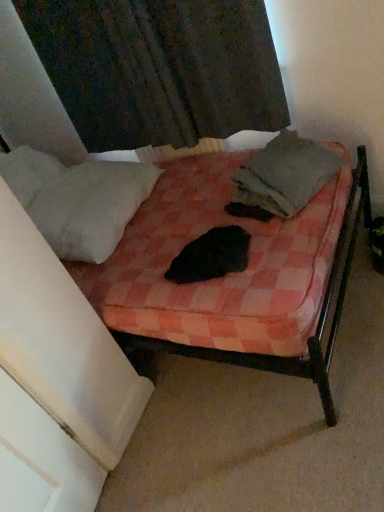
Question: Would you say pink checkered fabric bed at center is outside gray cotton blanket at center?

Choices:
 (A) yes
 (B) no

Answer: (A)

Question: Does pink checkered fabric bed at center appear on the right side of gray cotton blanket at center?

Choices:
 (A) no
 (B) yes

Answer: (A)

Question: Considering the relative sizes of pink checkered fabric bed at center and gray cotton blanket at center in the image provided, is pink checkered fabric bed at center bigger than gray cotton blanket at center?

Choices:
 (A) no
 (B) yes

Answer: (B)

Question: From a real-world perspective, is pink checkered fabric bed at center below gray cotton blanket at center?

Choices:
 (A) yes
 (B) no

Answer: (B)

Question: Does pink checkered fabric bed at center have a lesser width compared to gray cotton blanket at center?

Choices:
 (A) no
 (B) yes

Answer: (A)

Question: Is pink checkered fabric bed at center in contact with gray cotton blanket at center?

Choices:
 (A) no
 (B) yes

Answer: (A)

Question: Is white fluffy pillow at left bigger than gray cotton blanket at center?

Choices:
 (A) no
 (B) yes

Answer: (B)

Question: Is the position of white fluffy pillow at left less distant than that of gray cotton blanket at center?

Choices:
 (A) yes
 (B) no

Answer: (B)

Question: Would you say white fluffy pillow at left contains gray cotton blanket at center?

Choices:
 (A) no
 (B) yes

Answer: (A)

Question: Is white fluffy pillow at left positioned with its back to gray cotton blanket at center?

Choices:
 (A) no
 (B) yes

Answer: (A)

Question: From the image's perspective, does white fluffy pillow at left appear higher than gray cotton blanket at center?

Choices:
 (A) no
 (B) yes

Answer: (A)

Question: Can we say white fluffy pillow at left lies outside gray cotton blanket at center?

Choices:
 (A) no
 (B) yes

Answer: (B)

Question: Is dark fabric curtain at upper center not close to pink checkered fabric bed at center?

Choices:
 (A) no
 (B) yes

Answer: (A)